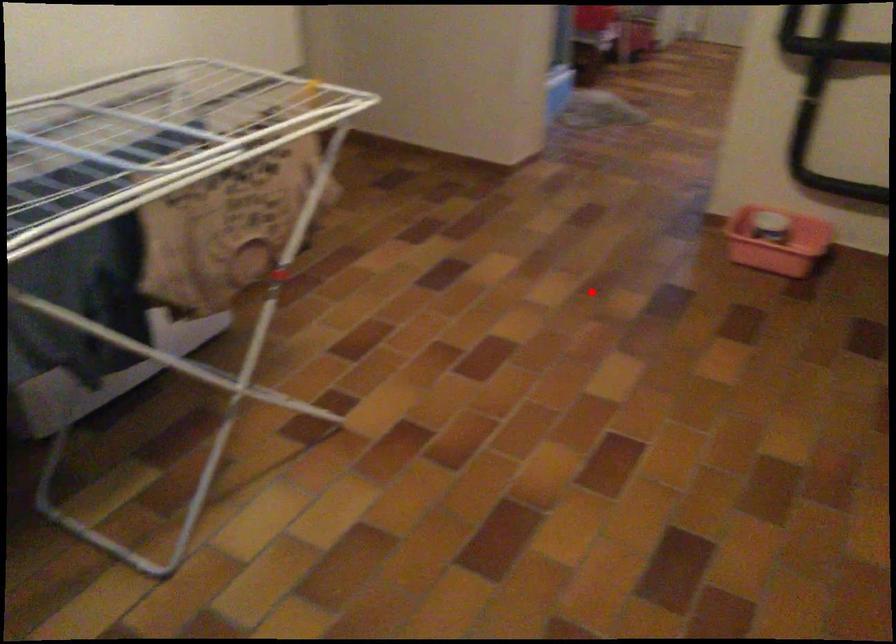
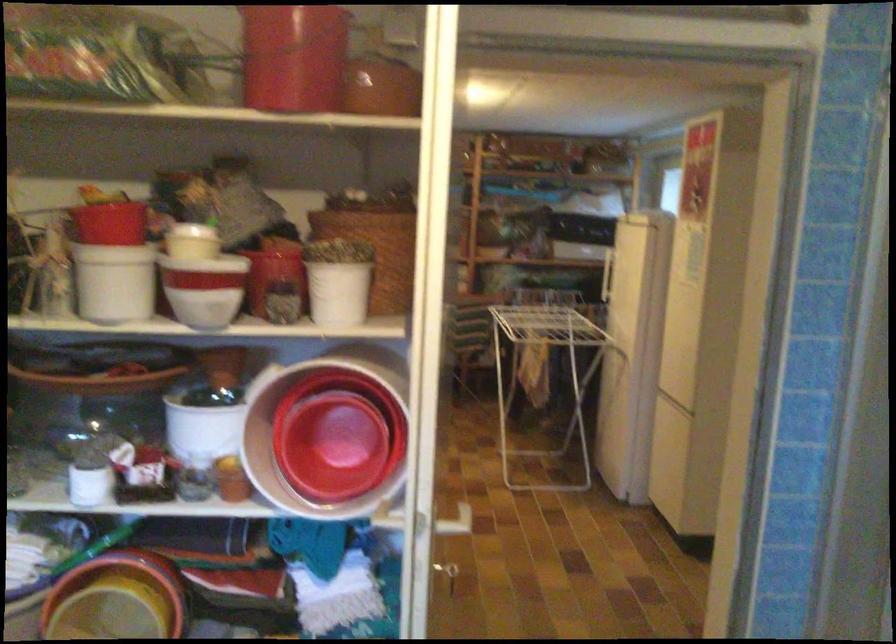
The point at the highlighted location is marked in the first image. Where is the corresponding point in the second image?

(449, 574)